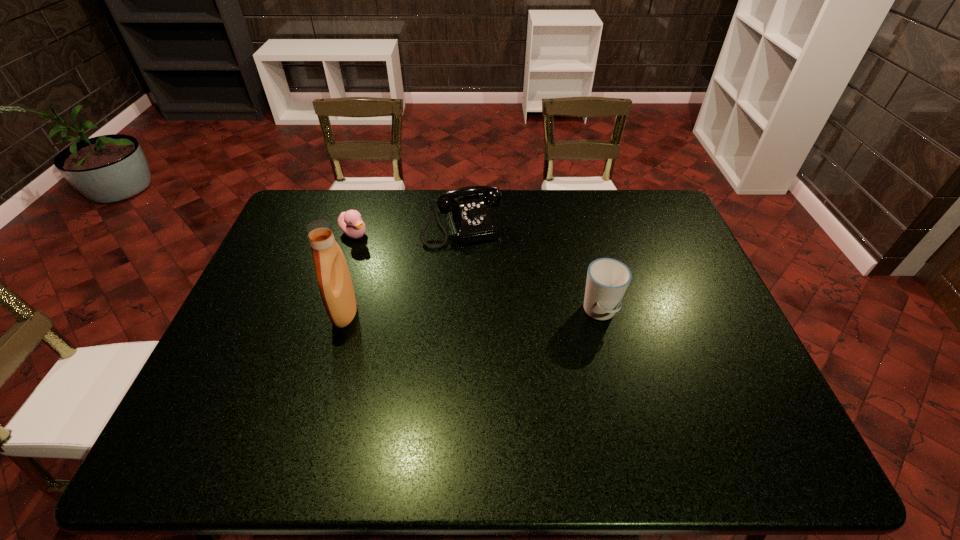
I want to click on the tallest object, so click(335, 284).

This screenshot has width=960, height=540. What are the coordinates of `the rightmost object` in the screenshot? It's located at pyautogui.click(x=607, y=280).

The height and width of the screenshot is (540, 960). I want to click on duckling, so click(x=350, y=222).

Image resolution: width=960 pixels, height=540 pixels. Identify the location of telephone. (471, 221).

Where is `vacant region located on the front-facing side of the tallest object`? vacant region located on the front-facing side of the tallest object is located at coordinates (276, 312).

This screenshot has height=540, width=960. What are the coordinates of `free space located on the front-facing side of the tallest object` in the screenshot? It's located at (248, 312).

Where is `free space located on the front-facing side of the tallest object`? free space located on the front-facing side of the tallest object is located at coordinates (294, 312).

I want to click on free space located 0.090m with a handle on the side of the cup, so click(612, 358).

Identify the location of vacant region located 0.280m on the front-facing side of the shortest object. The image size is (960, 540). click(424, 279).

The width and height of the screenshot is (960, 540). I want to click on vacant region located 0.320m on the front-facing side of the shortest object, so click(434, 286).